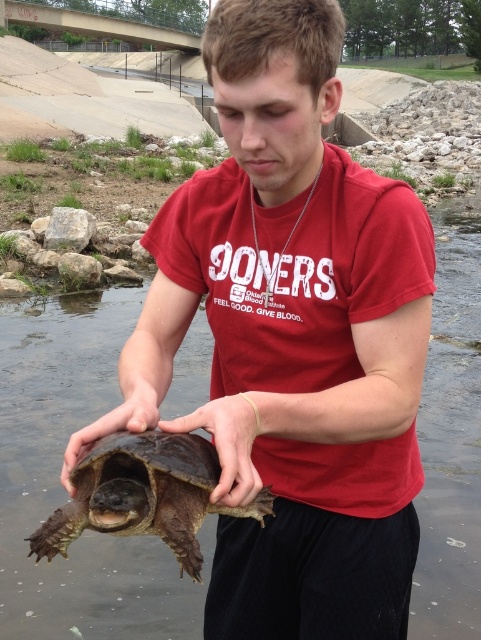
From the picture: You are a wildlife researcher observing the man and the turtle in the scene. Which object is positioned to the right of the other between the brown rough skin at center and the matte brown turtle at center?

The brown rough skin at center is positioned to the right of the matte brown turtle at center.

Looking at this image, you are a wildlife researcher observing a man holding two turtles. You need to determine which turtle is closer to the ground. The man is holding the brown rough tortoise at center and the matte brown turtle at center. Which turtle is closer to the ground?

The brown rough tortoise at center is positioned under matte brown turtle at center, so the brown rough tortoise at center is closer to the ground.

You are a photographer trying to capture the turtle in the image. The turtle is located at point (227,444). What is the color and texture of the area where the turtle is positioned?

The area at point (227,444) has brown rough skin texture.